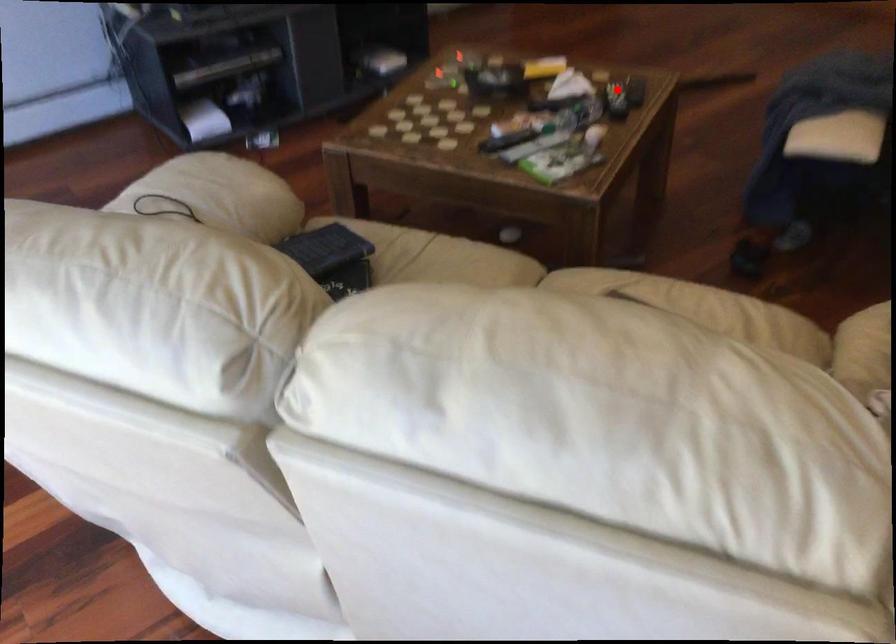
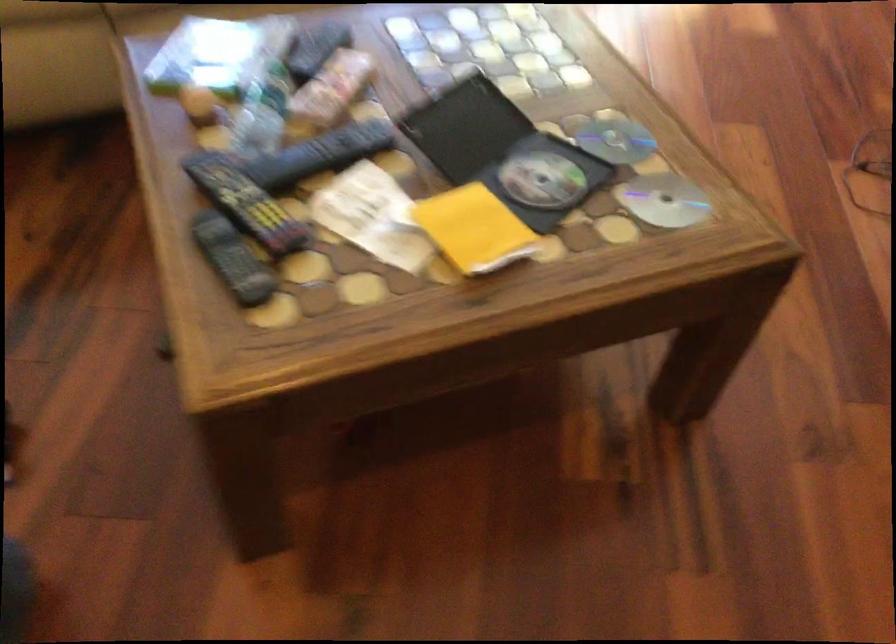
Where in the second image is the point corresponding to the highlighted location from the first image?

(245, 202)